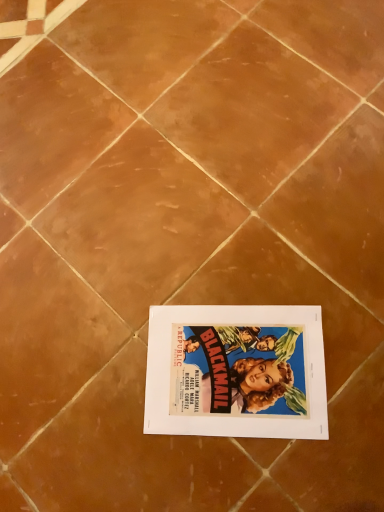
I want to click on vacant space situated on the left part of white paper at center, so click(100, 411).